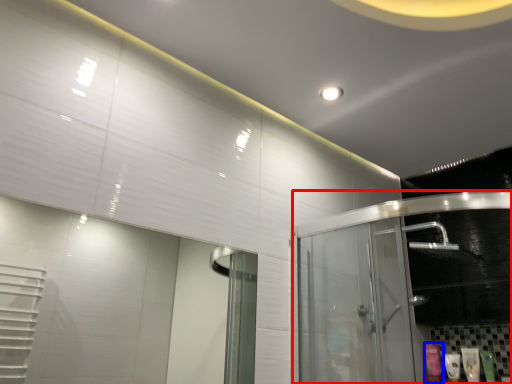
Question: Which object appears closest to the camera in this image, glass door (highlighted by a red box) or toiletry (highlighted by a blue box)?

Choices:
 (A) glass door
 (B) toiletry

Answer: (A)